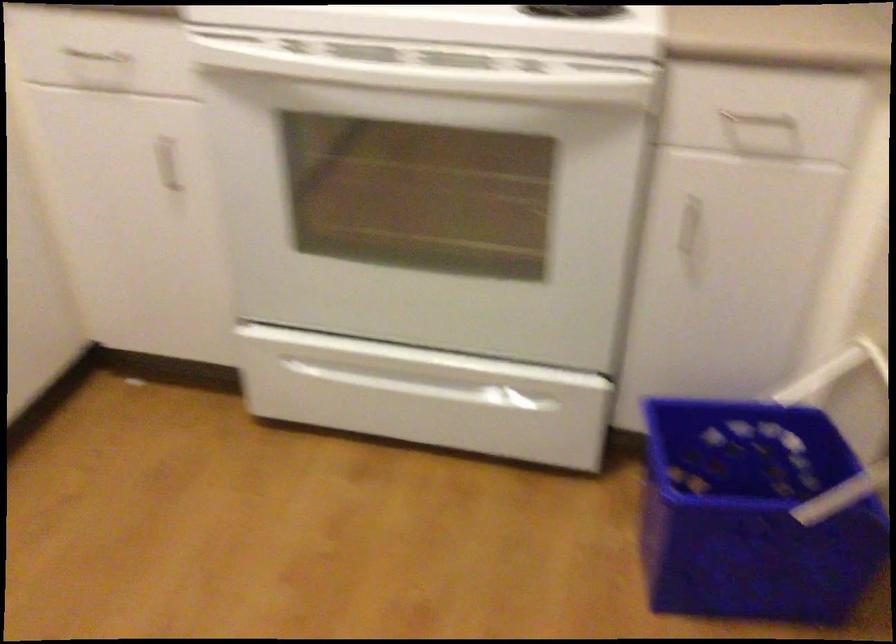
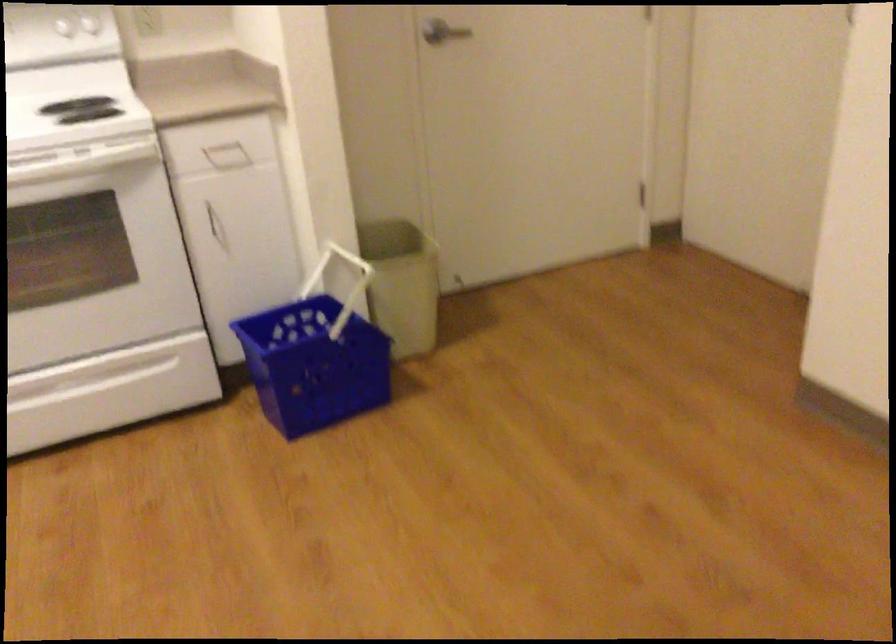
The point at [686,238] is marked in the first image. Where is the corresponding point in the second image?

(216, 225)